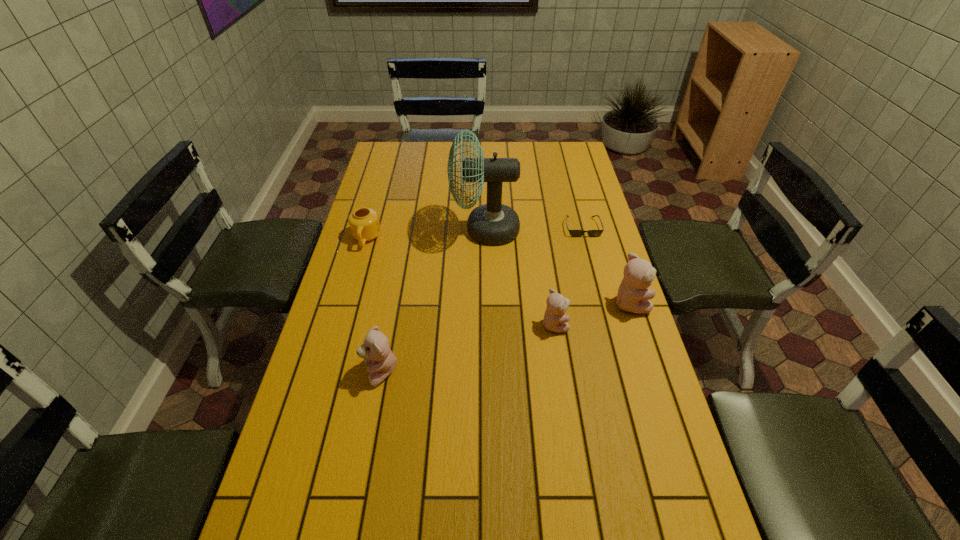
To achieve uniform spacing by inserting another teddy_bear among them, please point to a free space for this new teddy_bear. Please provide its 2D coordinates. Your answer should be formatted as a tuple, i.e. [(x, y)], where the tuple contains the x and y coordinates of a point satisfying the conditions above.

[(471, 347)]